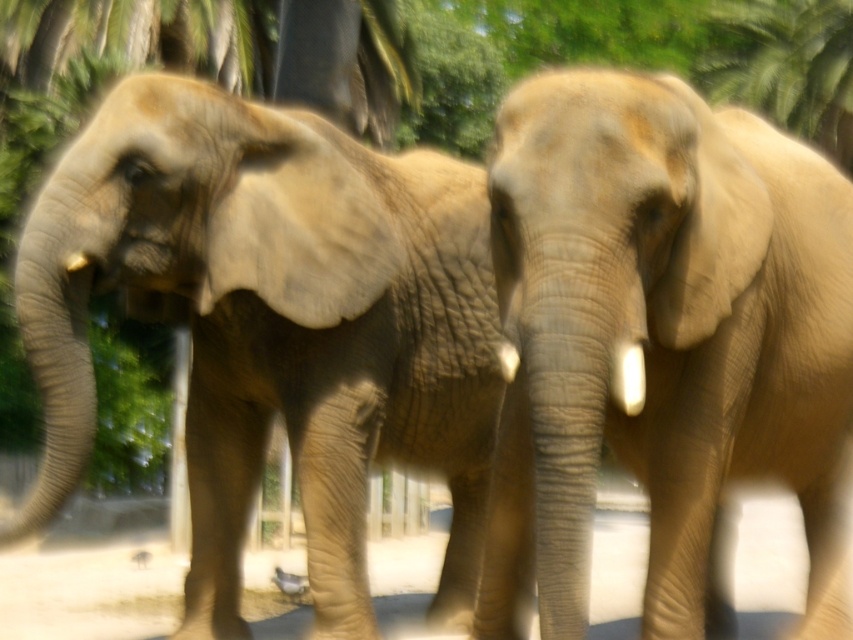
Between smooth beige elephant at center and wooden fence at lower center, which one appears on the left side from the viewer's perspective?

From the viewer's perspective, wooden fence at lower center appears more on the left side.

Can you confirm if smooth beige elephant at center is positioned to the left of wooden fence at lower center?

No, smooth beige elephant at center is not to the left of wooden fence at lower center.

I want to click on smooth beige elephant at center, so click(662, 340).

I want to click on smooth beige elephant at center, so coord(662,340).

Looking at this image, is the position of gray textured elephant at center more distant than that of wooden fence at lower center?

No, gray textured elephant at center is closer to the viewer.

From the picture: Which is below, gray textured elephant at center or wooden fence at lower center?

Positioned lower is wooden fence at lower center.

In order to click on gray textured elephant at center in this screenshot , I will do `click(273, 324)`.

Image resolution: width=853 pixels, height=640 pixels. Identify the location of gray textured elephant at center. [x=273, y=324].

Can you confirm if gray textured elephant at center is shorter than smooth beige elephant at center?

In fact, gray textured elephant at center may be taller than smooth beige elephant at center.

Which of these two, gray textured elephant at center or smooth beige elephant at center, stands shorter?

smooth beige elephant at center is shorter.

Is point (309, 164) positioned behind point (531, 145)?

Yes.

The image size is (853, 640). What are the coordinates of `gray textured elephant at center` in the screenshot? It's located at point(273,324).